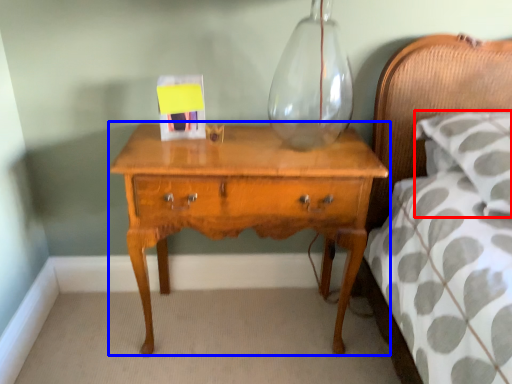
Question: Which of the following is the closest to the observer, pillow (highlighted by a red box) or nightstand (highlighted by a blue box)?

Choices:
 (A) pillow
 (B) nightstand

Answer: (A)